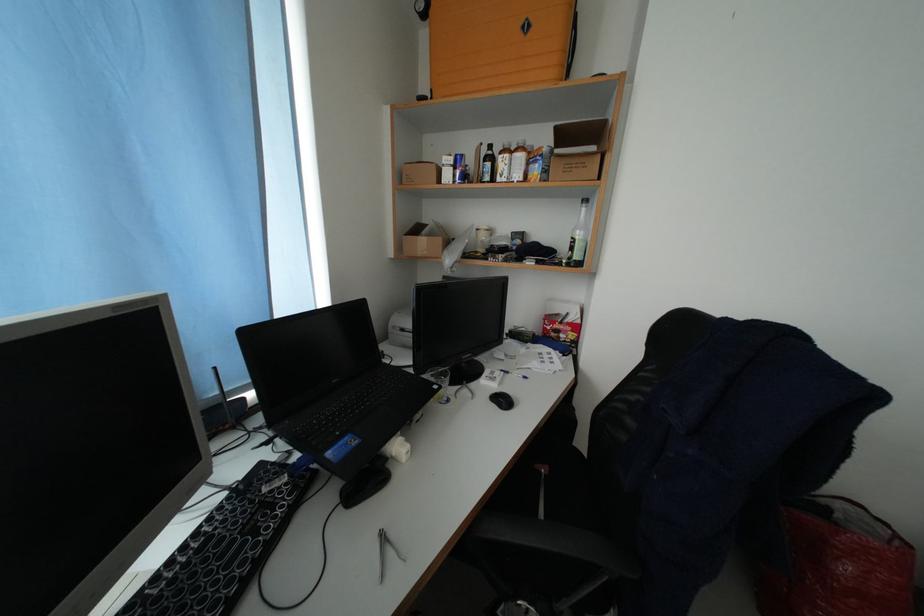
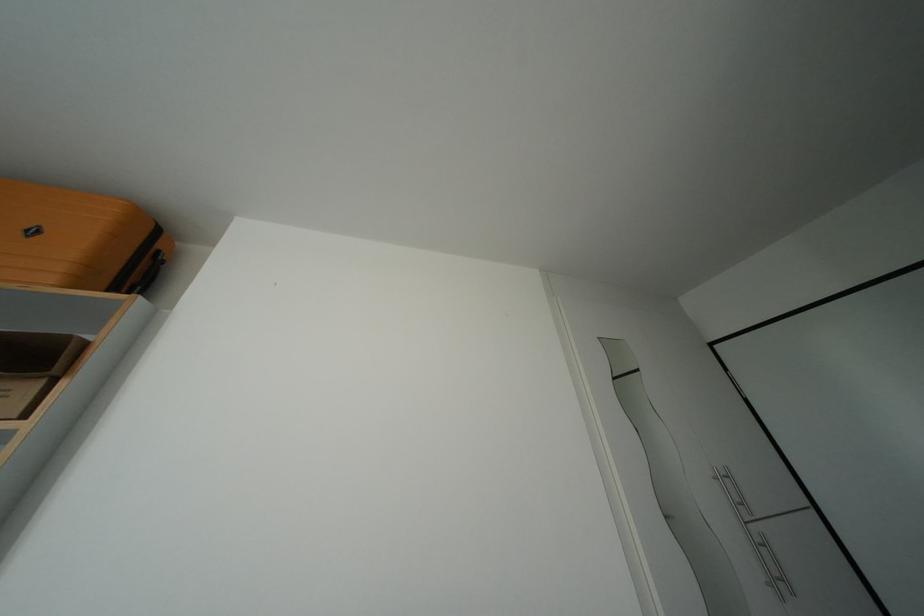
Find the pixel in the second image that matches the point at 614,127 in the first image.

(76, 342)